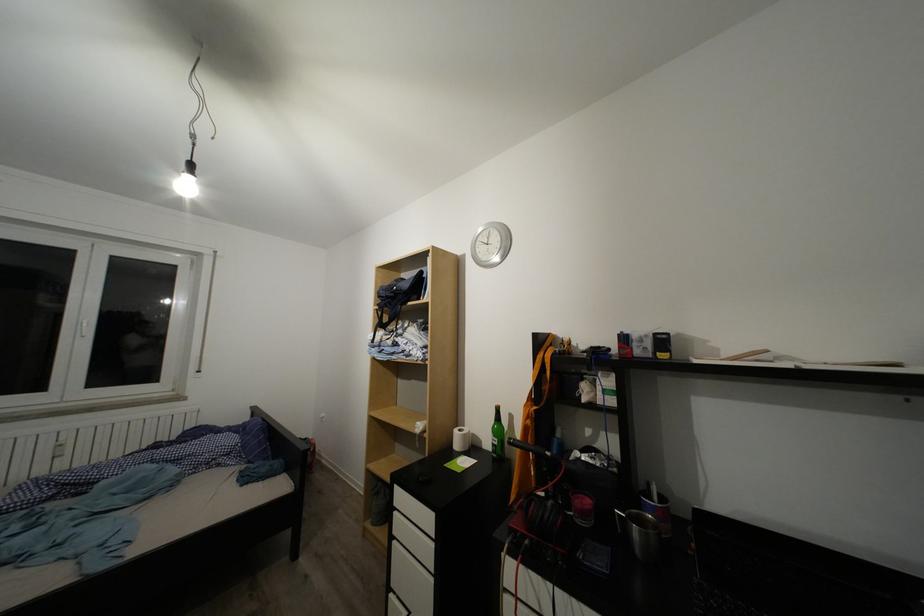
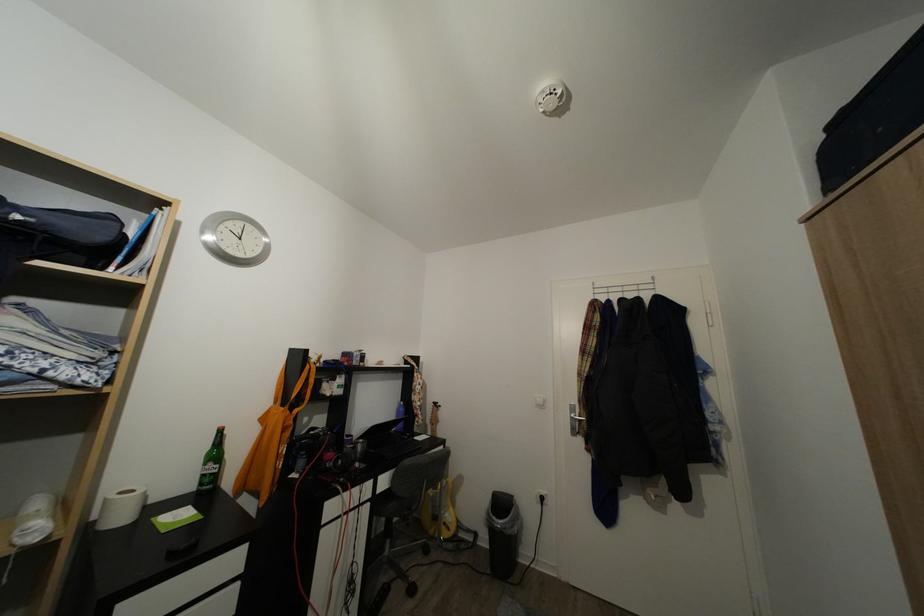
Locate, in the second image, the point that corresponds to (x=468, y=436) in the first image.

(129, 500)